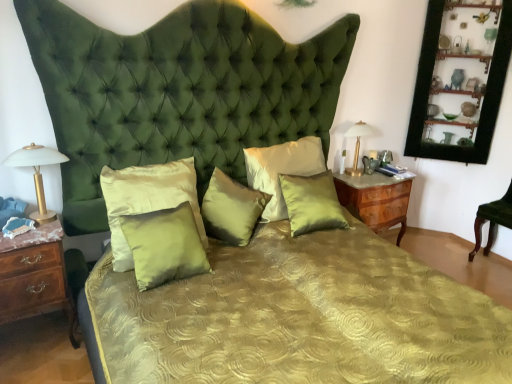
You are a GUI agent. You are given a task and a screenshot of the screen. Output one action in this format:
    pyautogui.click(x=<x>, y=<y>)
    Task: Click on the vacant region above wooden nightstand at right, arranged as the first nightstand when viewed from the back (from a real-world perspective)
    This screenshot has width=512, height=384.
    Given the screenshot: What is the action you would take?
    pyautogui.click(x=374, y=176)